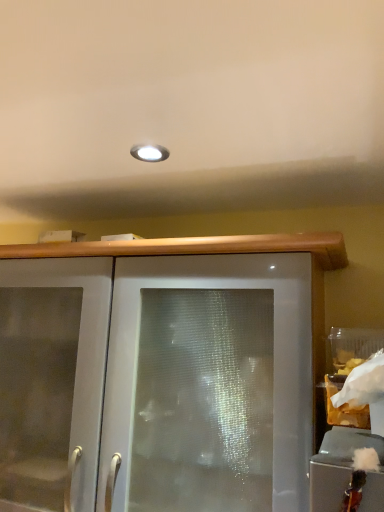
Question: Visually, is white paper bag at right positioned to the left or to the right of frosted glass cabinet at lower right, arranged as the 1th cabinetry when viewed from the top?

Choices:
 (A) right
 (B) left

Answer: (A)

Question: From a real-world perspective, is white paper bag at right above or below frosted glass cabinet at lower right, which is the first cabinetry in right-to-left order?

Choices:
 (A) above
 (B) below

Answer: (A)

Question: Based on their relative distances, which object is nearer to the white paper bag at right?

Choices:
 (A) satin white cabinet at center, positioned as the 2th cabinetry in top-to-bottom order
 (B) frosted glass cabinet at lower right, which is the second cabinetry in back-to-front order

Answer: (B)

Question: Estimate the real-world distances between objects in this image. Which object is farther from the white paper bag at right?

Choices:
 (A) frosted glass cabinet at lower right, acting as the first cabinetry starting from the front
 (B) satin white cabinet at center, placed as the second cabinetry when sorted from front to back

Answer: (B)